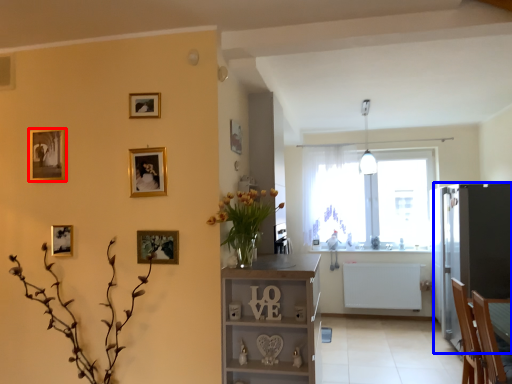
Question: Which point is further to the camera, picture frame (highlighted by a red box) or fridge (highlighted by a blue box)?

Choices:
 (A) picture frame
 (B) fridge

Answer: (B)